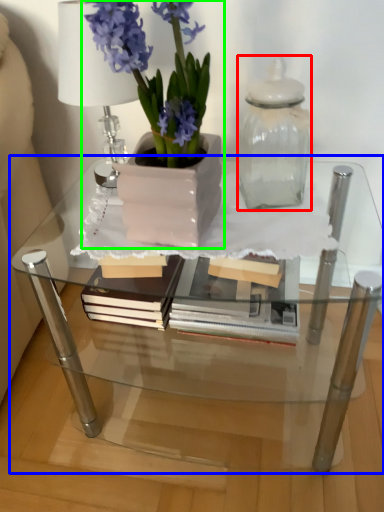
Question: Estimate the real-world distances between objects in this image. Which object is closer to glass vase (highlighted by a red box), table (highlighted by a blue box) or houseplant (highlighted by a green box)?

Choices:
 (A) table
 (B) houseplant

Answer: (B)